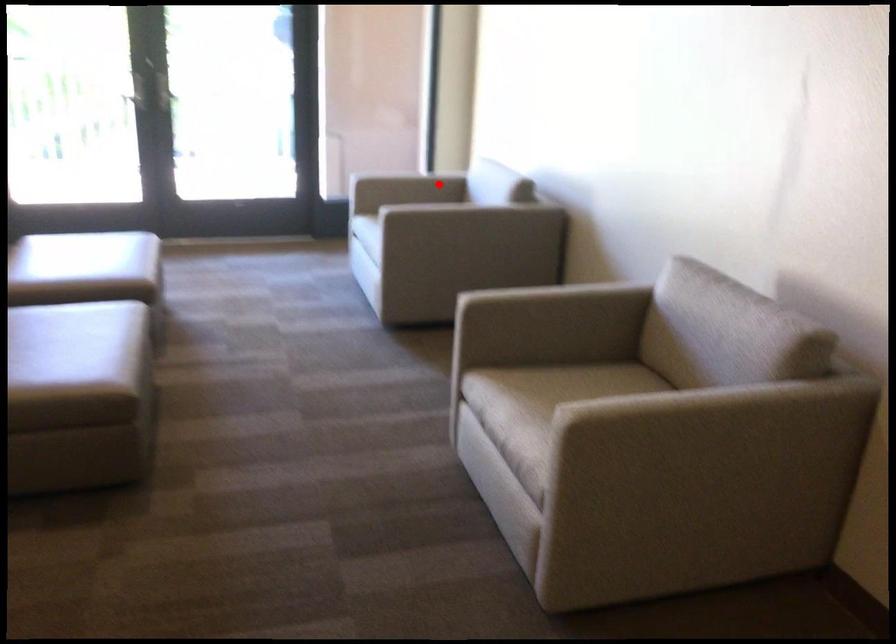
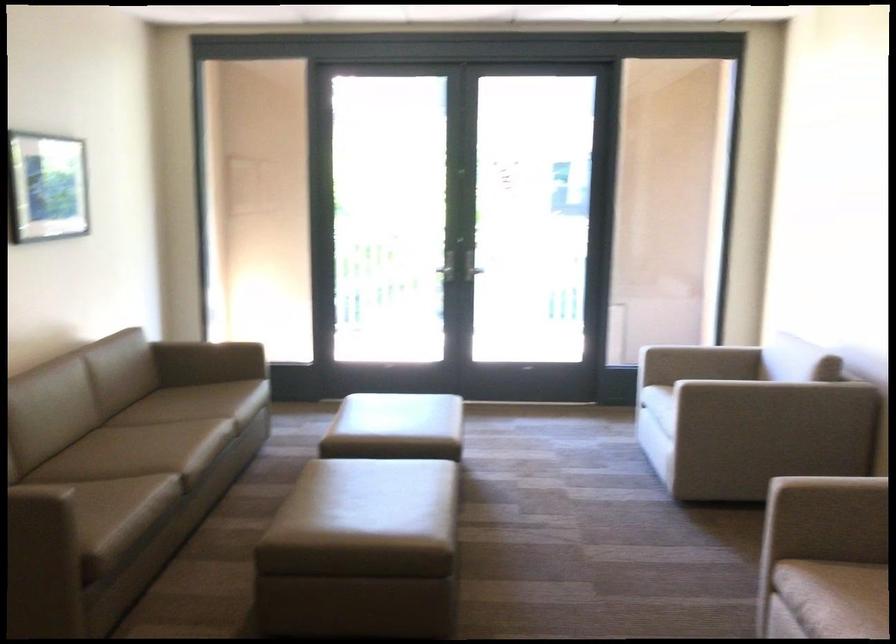
In the second image, find the point that corresponds to the highlighted location in the first image.

(734, 363)